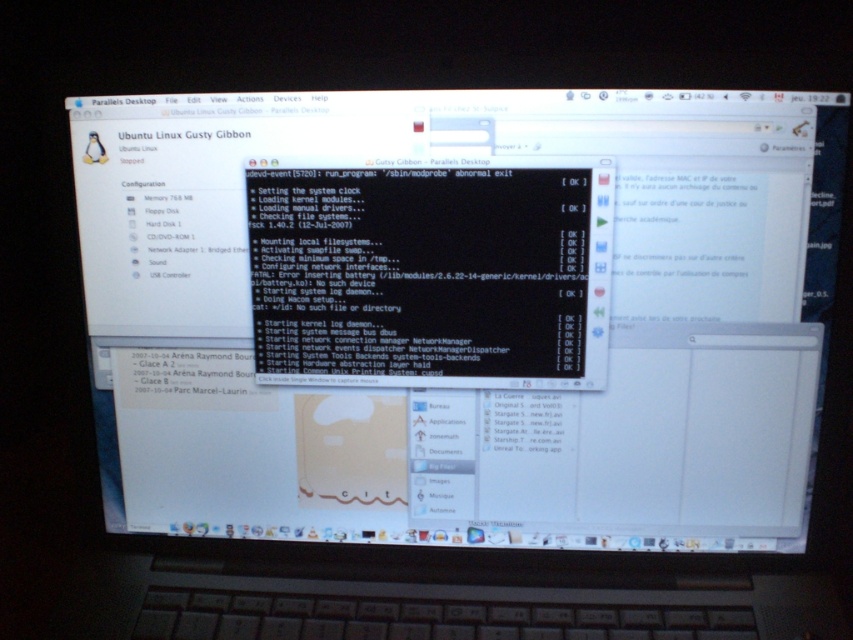
Does point (381, 108) come in front of point (537, 268)?

Yes, it is in front of point (537, 268).

Consider the image. Which is below, black glossy terminal at center or black glossy text at center?

black glossy terminal at center

The image size is (853, 640). What do you see at coordinates (460, 314) in the screenshot? I see `black glossy terminal at center` at bounding box center [460, 314].

Where is `black glossy terminal at center`? The height and width of the screenshot is (640, 853). black glossy terminal at center is located at coordinates (460, 314).